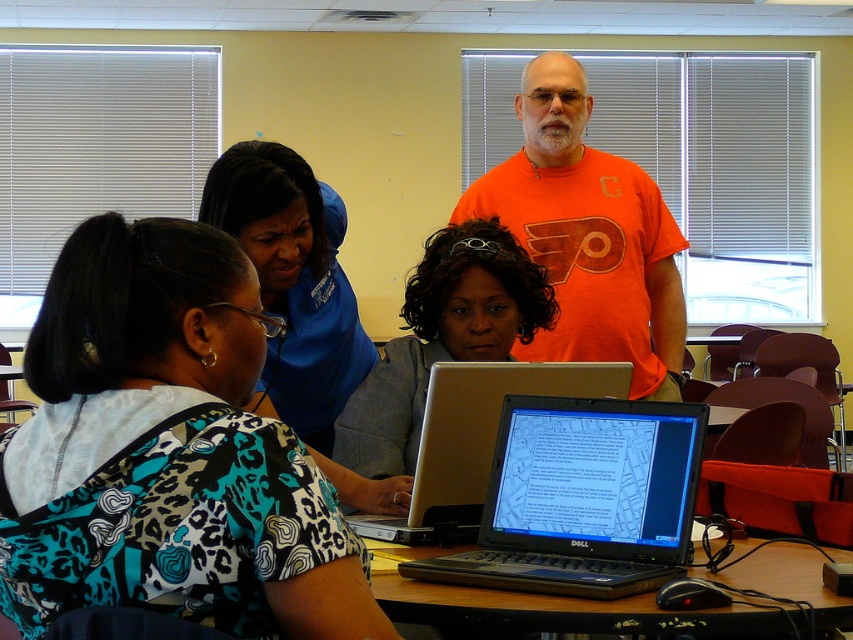
Question: Can you confirm if orange cotton t-shirt at center is bigger than silver metallic laptop at center?

Choices:
 (A) yes
 (B) no

Answer: (A)

Question: Can you confirm if gray fabric shirt at center is positioned to the right of black plastic table at center?

Choices:
 (A) yes
 (B) no

Answer: (B)

Question: Which object appears farthest from the camera in this image?

Choices:
 (A) silver metallic laptop at center
 (B) blue fabric shirt at upper center

Answer: (B)

Question: Is orange cotton t-shirt at center bigger than blue fabric shirt at upper center?

Choices:
 (A) yes
 (B) no

Answer: (A)

Question: Which of these objects is positioned closest to the gray fabric shirt at center?

Choices:
 (A) orange cotton t-shirt at center
 (B) blue fabric shirt at upper center
 (C) black plastic table at center

Answer: (B)

Question: Which object is positioned farthest from the black plastic laptop at center?

Choices:
 (A) silver metallic laptop at center
 (B) blue fabric shirt at upper center
 (C) printed fabric shirt at center
 (D) orange cotton t-shirt at center

Answer: (D)